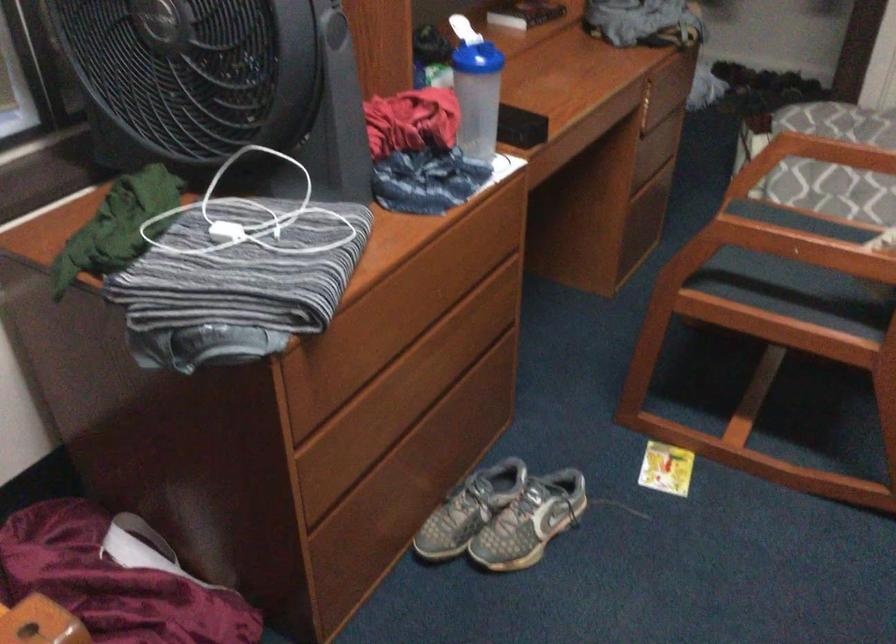
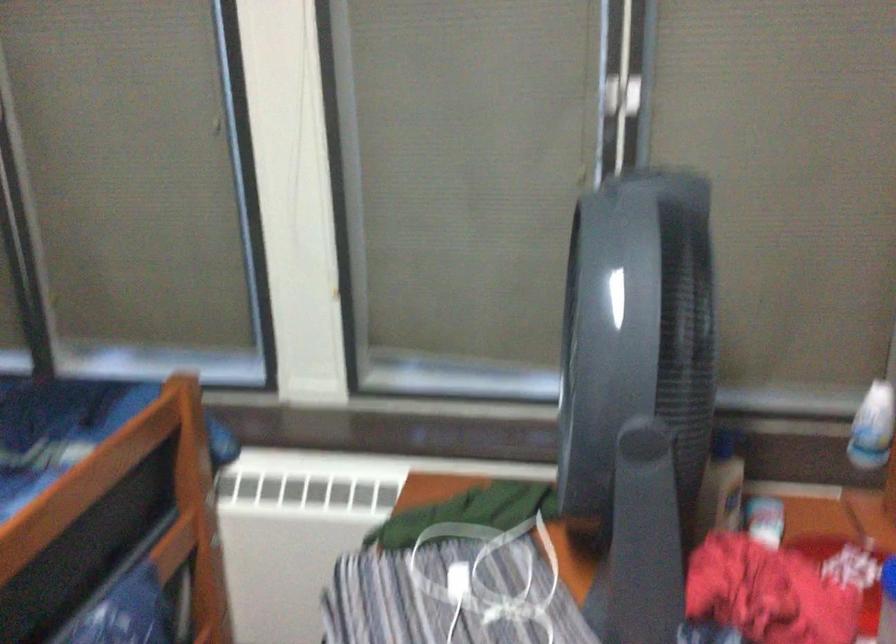
The point at (343, 100) is marked in the first image. Where is the corresponding point in the second image?

(645, 521)